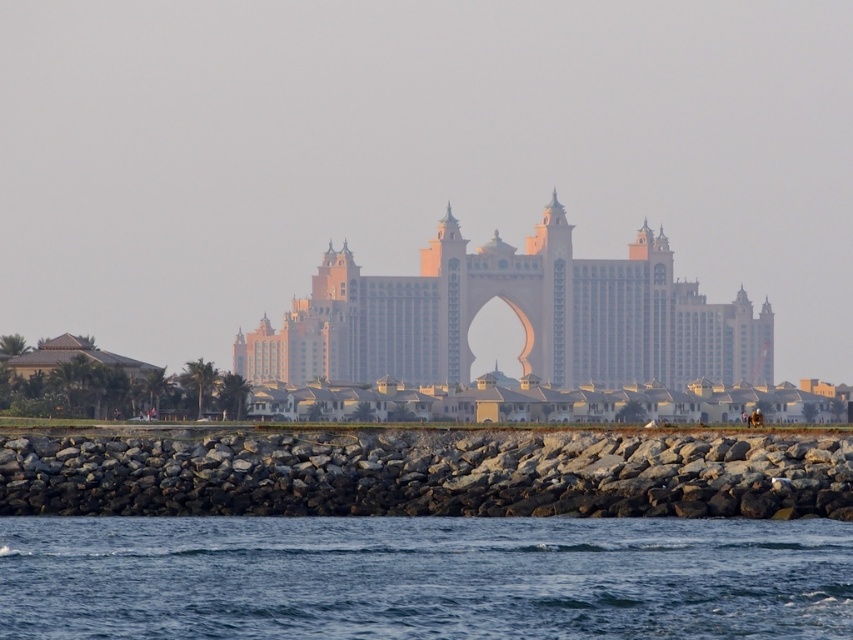
You are standing at the edge of the water near the gray rock wall at lower center and want to take a photo of the golden stone palace at center. Which direction should you move to get the palace in your view without the gray rock wall blocking it?

The gray rock wall at lower center is in front of the golden stone palace at center, so you should move backward away from the gray rock wall at lower center to get the golden stone palace at center in your view without obstruction.

In the scene shown: You are standing at the point with coordinates point (440, 266) and want to look towards the point with coordinates point (544, 620). Which direction should you face?

You should face forward because point (544, 620) is in front of point (440, 266).